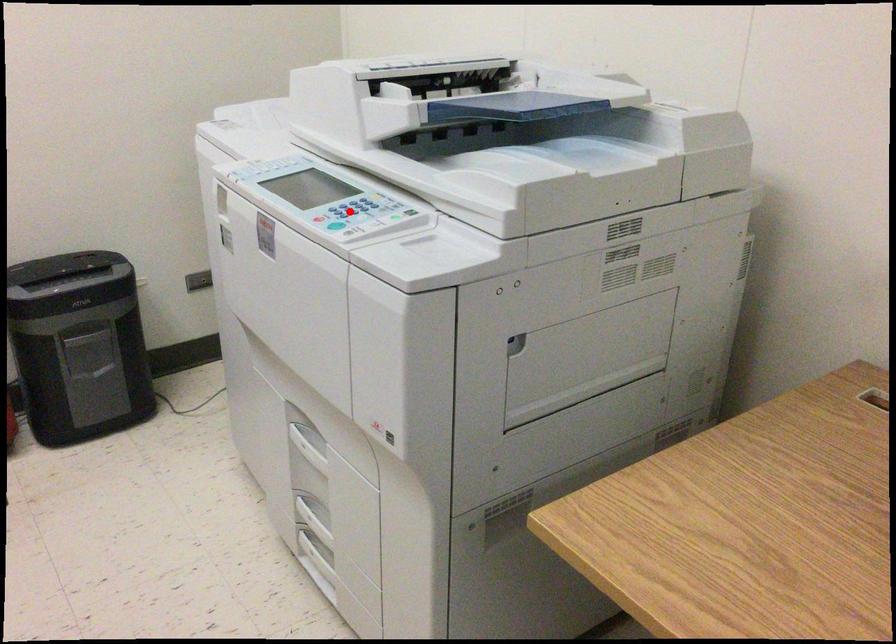
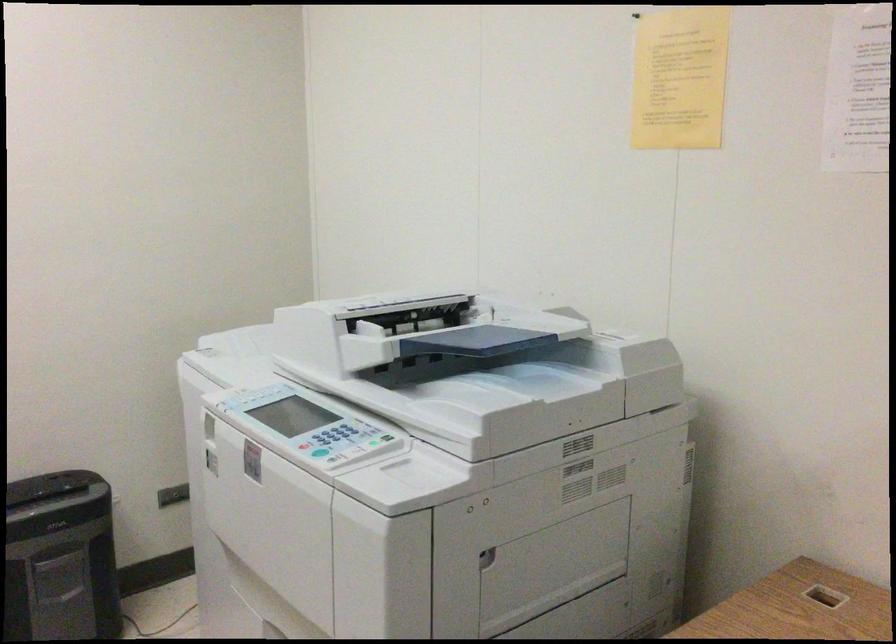
Question: I am providing you with two images of the same scene from different viewpoints. A red point is shown in image1. For the corresponding object point in image2, is it positioned nearer or farther from the camera?

Choices:
 (A) Nearer
 (B) Farther

Answer: (B)